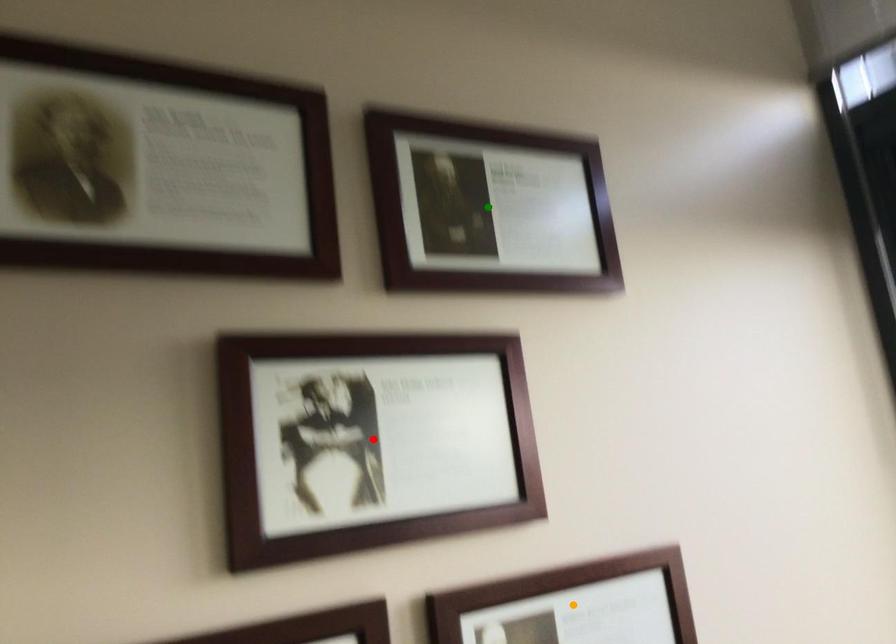
Order these from nearest to farthest:
1. green point
2. red point
3. orange point

orange point < red point < green point